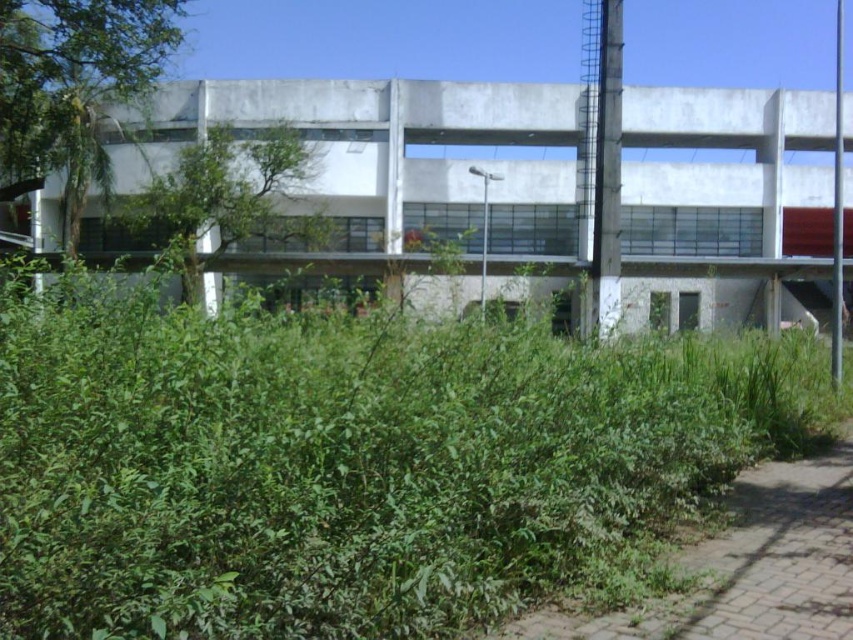
You are standing at point (352, 460) in the image. What do you see immediately around you?

You see a green leafy bush at center immediately around you.

You are a gardener assessing the outdoor area in front of the building. You see the green leafy bush at center and the green grass at lower right. Which of these two plants is positioned higher relative to the other?

The green leafy bush at center is positioned above the green grass at lower right.

You are standing at the entrance of the building and want to walk towards the point labeled point (x=799, y=339). However, there is a dense thicket of bushes between you and point (x=625, y=634). Can you safely navigate around the bushes to reach your destination?

Point (x=799, y=339) is further to the camera than point (x=625, y=634), so the bushes at point (x=625, y=634) are closer to you. Therefore, you can navigate around them to reach the destination safely.